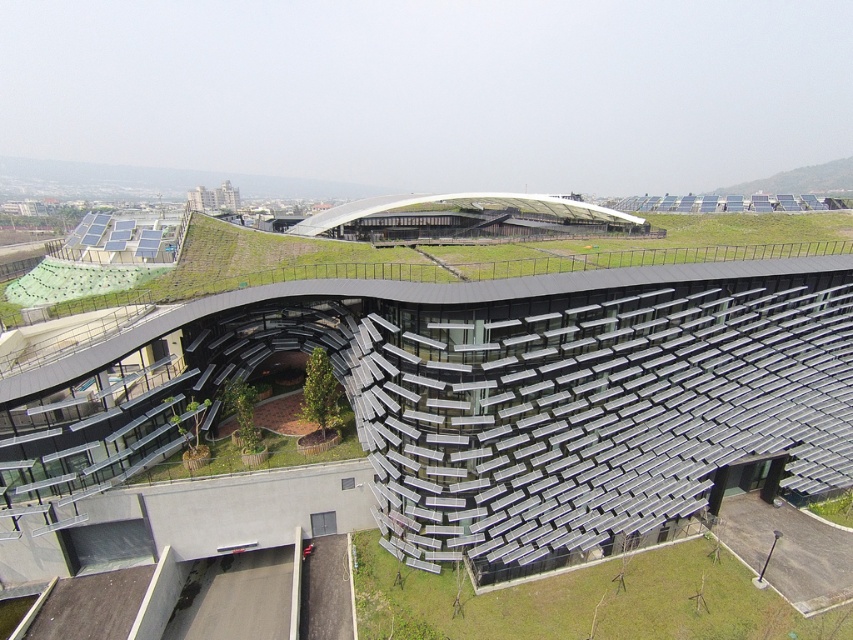
You are an architect designing a new eco building. You have to decide whether to place a large sculpture between the metallic solar panels at center and the green grass at lower center. Since the sculpture requires a space equal to the combined area of both, will there be enough space?

The metallic solar panels at center is bigger than green grass at lower center. The combined area of both would be larger than the space available between them, so there won

You are standing at a distance from a modern building with solar panels and a green roof. There is a specific point marked at coordinates point (669,456). Can you estimate how far you are from this point?

The distance of point (669,456) from the viewer is 41.11 meters.